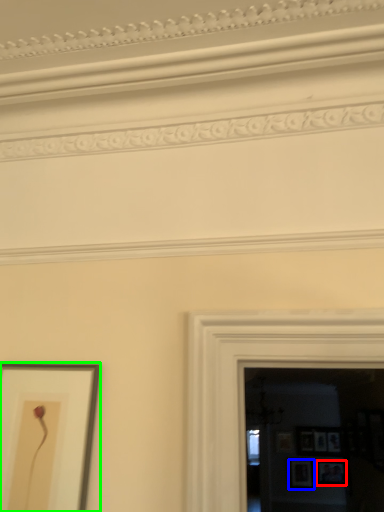
Question: Based on their relative distances, which object is farther from picture frame (highlighted by a red box)? Choose from picture frame (highlighted by a blue box) and picture frame (highlighted by a green box).

Choices:
 (A) picture frame
 (B) picture frame

Answer: (B)